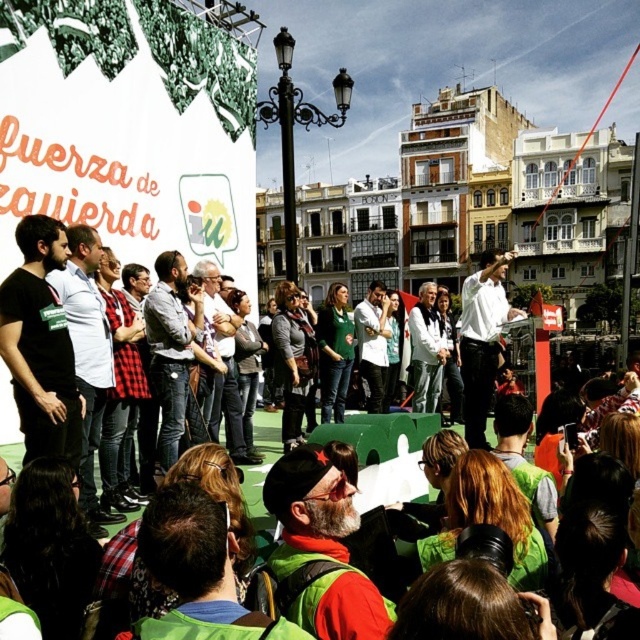
You are a photographer at the event and want to capture the speaker wearing the matte black shirt at left. Based on the coordinates provided, where should you position your camera to ensure the speaker is centered in the frame?

The matte black shirt at left is located at coordinates point (40, 344), so you should position your camera so that the center of the frame aligns with these coordinates to capture the speaker wearing the matte black shirt at left.

You are at the political rally and want to take a photo of both the speaker and the crowd. The speaker is at point (x=45, y=348) and the crowd is at point (x=506, y=320). Since you want to capture both clearly, which point should you focus on first to ensure the speaker is sharp?

You should focus on point (x=45, y=348) first because it is closer to the camera than point (x=506, y=320), ensuring the speaker is in focus before adjusting for the crowd.